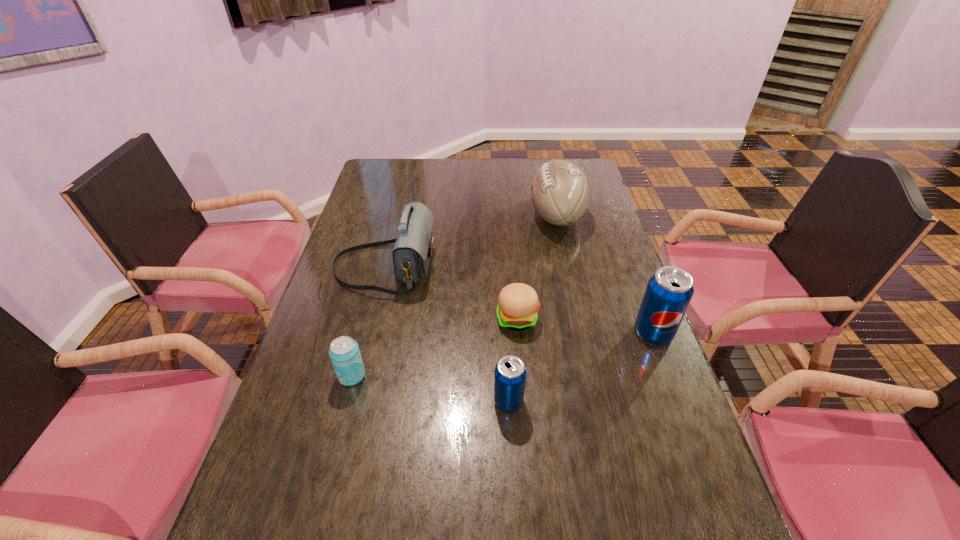
This screenshot has width=960, height=540. In the image, there is a desktop. Identify the location of free space at the far edge. (483, 159).

I want to click on vacant space at the near edge of the desktop, so click(x=440, y=507).

Locate an element on the screen. vacant space at the left edge of the desktop is located at coordinates (372, 307).

In the image, there is a desktop. Identify the location of vacant space at the right edge. The height and width of the screenshot is (540, 960). (680, 462).

In the image, there is a desktop. Where is `free region at the far left corner`? Image resolution: width=960 pixels, height=540 pixels. free region at the far left corner is located at coordinates (406, 177).

The height and width of the screenshot is (540, 960). Find the location of `free space that is in between the hamburger and the fifth object from left to right`. free space that is in between the hamburger and the fifth object from left to right is located at coordinates (537, 267).

What are the coordinates of `free space between the beer can and the nearer pop soda` in the screenshot? It's located at (430, 388).

Image resolution: width=960 pixels, height=540 pixels. I want to click on vacant space that is in between the fifth object from left to right and the rightmost object, so click(605, 274).

This screenshot has width=960, height=540. What are the coordinates of `blank region between the nearer pop soda and the right pop soda` in the screenshot? It's located at (581, 367).

Locate an element on the screen. blank region between the football (American) and the shoulder bag is located at coordinates (470, 241).